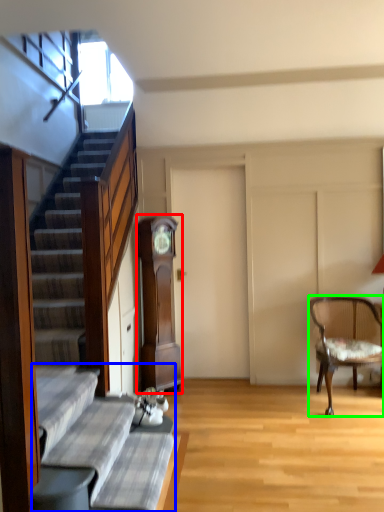
Question: Which object is the closest to the cabinetry (highlighted by a red box)? Choose among these: couch (highlighted by a blue box) or chair (highlighted by a green box).

Choices:
 (A) couch
 (B) chair

Answer: (B)